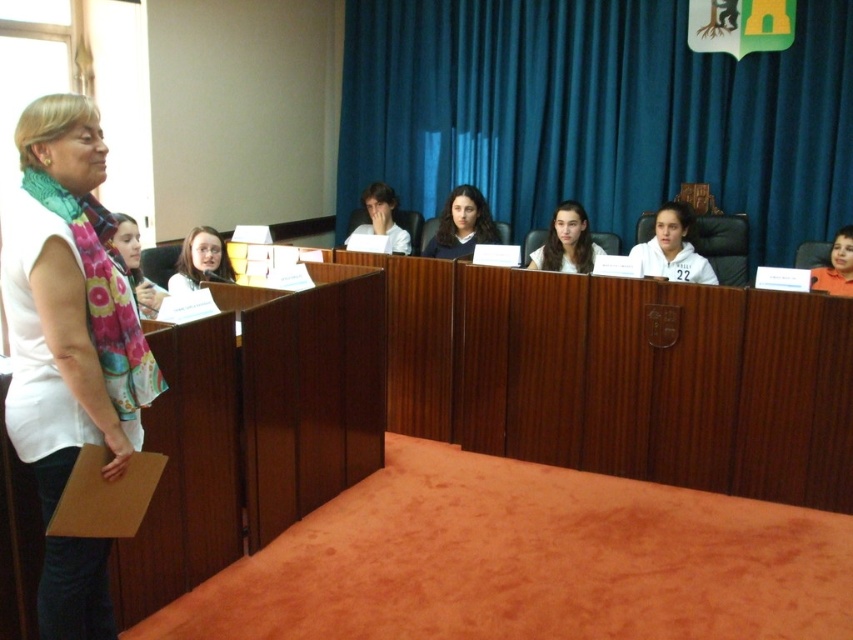
Question: Does white matte shirt at center have a smaller size compared to smooth skin face at upper right?

Choices:
 (A) yes
 (B) no

Answer: (A)

Question: Among these objects, which one is farthest from the camera?

Choices:
 (A) smooth black hair at center
 (B) matte white shirt at center
 (C) white matte shirt at center

Answer: (B)

Question: Is smooth brown hair at center positioned at the back of smooth skin face at upper right?

Choices:
 (A) yes
 (B) no

Answer: (A)

Question: Which point appears farthest from the camera in this image?

Choices:
 (A) (62, 124)
 (B) (467, 108)

Answer: (B)

Question: Among these points, which one is farthest from the camera?

Choices:
 (A) (393, 230)
 (B) (42, 394)

Answer: (A)

Question: Is smooth black hair at center smaller than smooth brown hair at center?

Choices:
 (A) yes
 (B) no

Answer: (B)